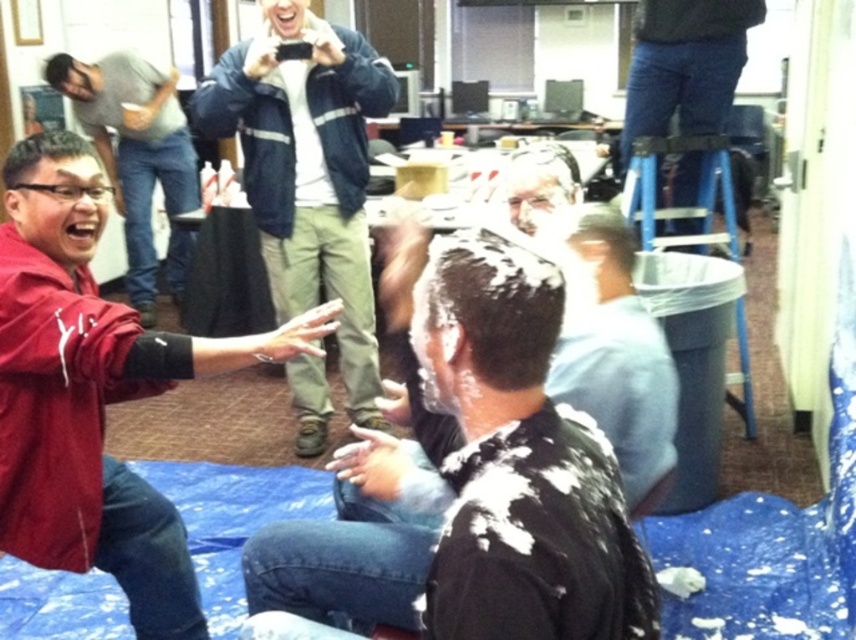
Question: Does shiny black shirt at center appear on the right side of denim jacket at center?

Choices:
 (A) yes
 (B) no

Answer: (A)

Question: Where is matte red jacket at center-left located in relation to jeans at upper right in the image?

Choices:
 (A) above
 (B) below

Answer: (B)

Question: Which point appears farthest from the camera in this image?

Choices:
 (A) [143, 138]
 (B) [415, 596]
 (C) [348, 83]
 (D) [84, 410]

Answer: (A)

Question: Does matte red jacket at center-left appear over denim jacket at center?

Choices:
 (A) no
 (B) yes

Answer: (A)

Question: Among these objects, which one is farthest from the camera?

Choices:
 (A) jeans at upper right
 (B) shiny black shirt at center
 (C) denim jacket at center
 (D) matte red jacket at left

Answer: (D)

Question: Which object appears farthest from the camera in this image?

Choices:
 (A) shiny black shirt at center
 (B) matte red jacket at left

Answer: (B)